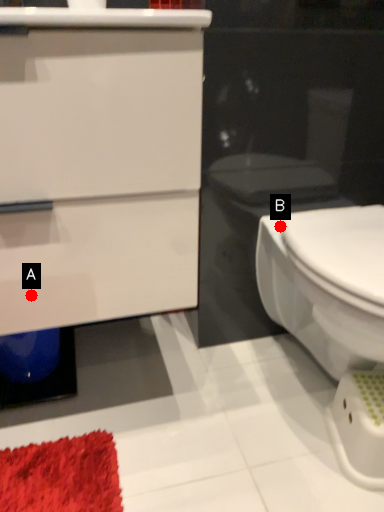
Question: Two points are circled on the image, labeled by A and B beside each circle. Which point is closer to the camera taking this photo?

Choices:
 (A) A is closer
 (B) B is closer

Answer: (A)